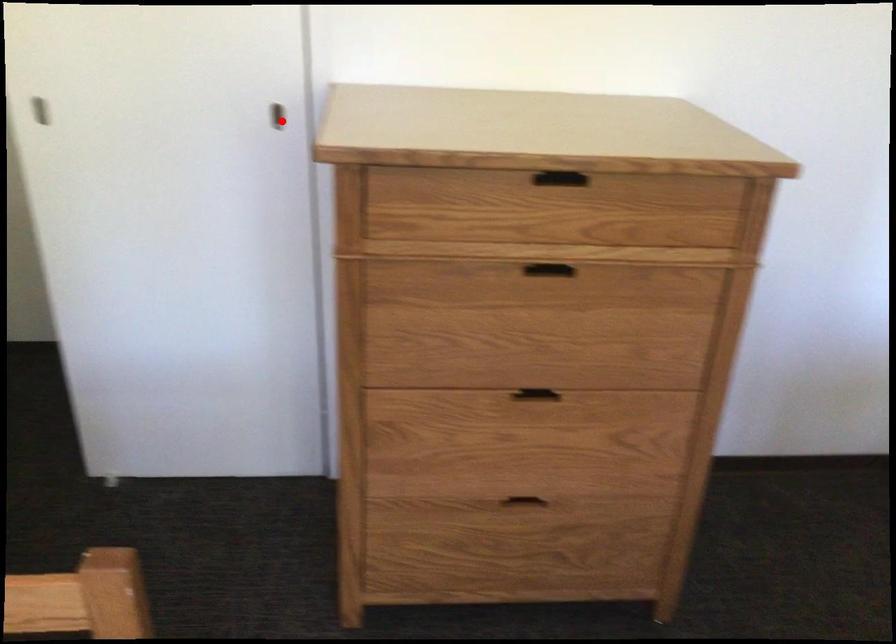
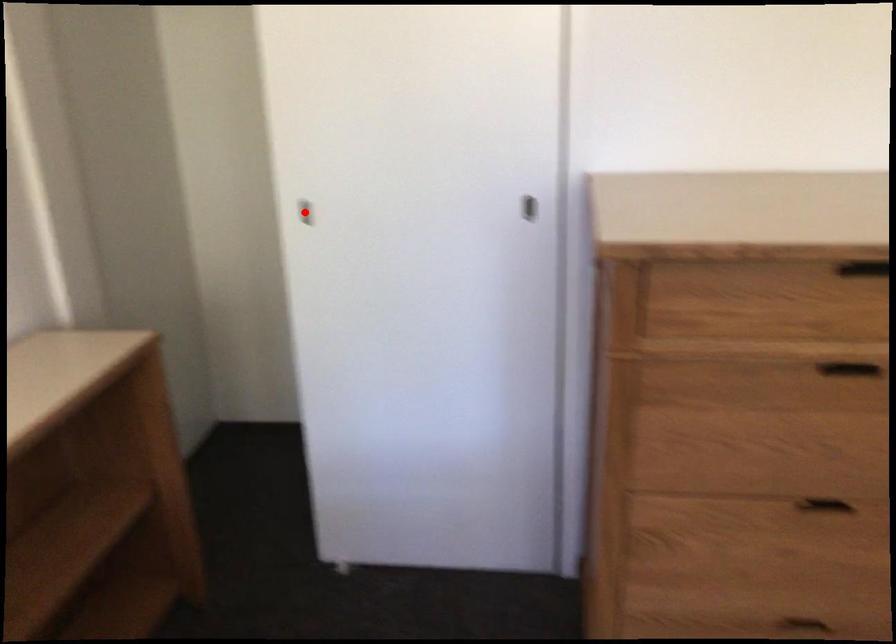
I am providing you with two images of the same scene from different viewpoints. A red point is marked on the first image and another point is marked on the second image. Are the points marked in image1 and image2 representing the same 3D position?

No